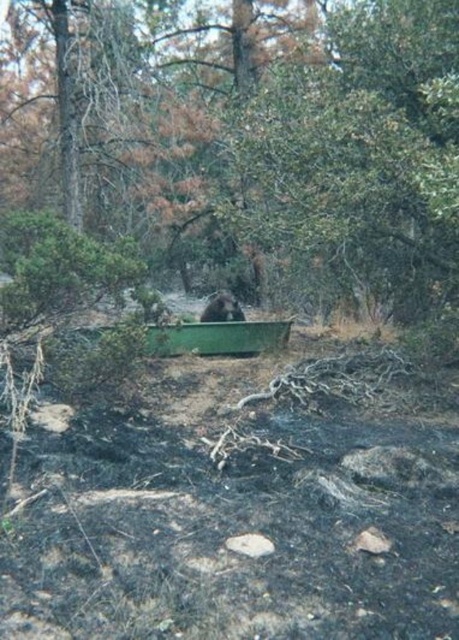
Between point (257, 323) and point (201, 316), which one is positioned behind?

The point (201, 316) is more distant.

Does green matte canoe at center appear on the left side of brown furry bear at center?

Indeed, green matte canoe at center is positioned on the left side of brown furry bear at center.

Is point (212, 340) less distant than point (231, 314)?

Yes.

Identify the location of green matte canoe at center. pos(218,337).